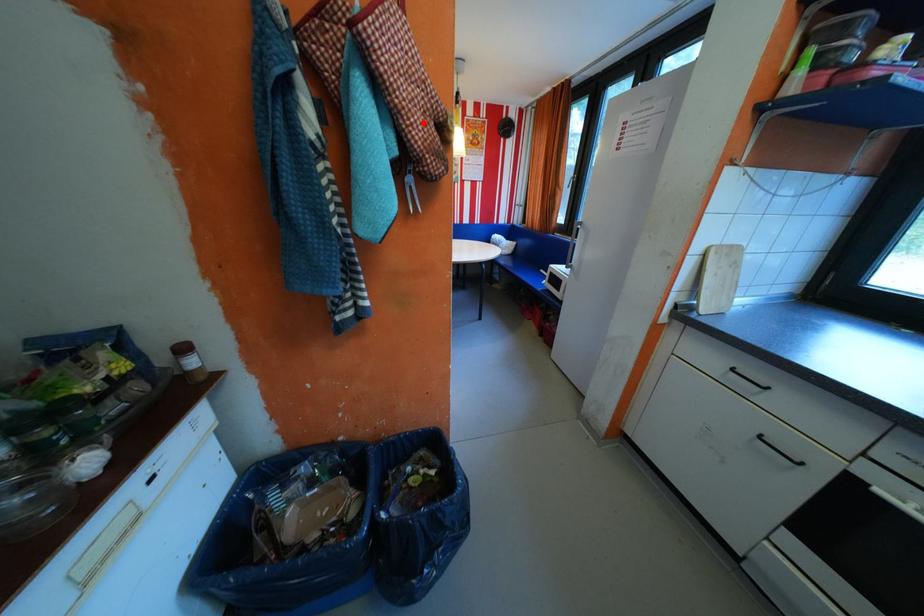
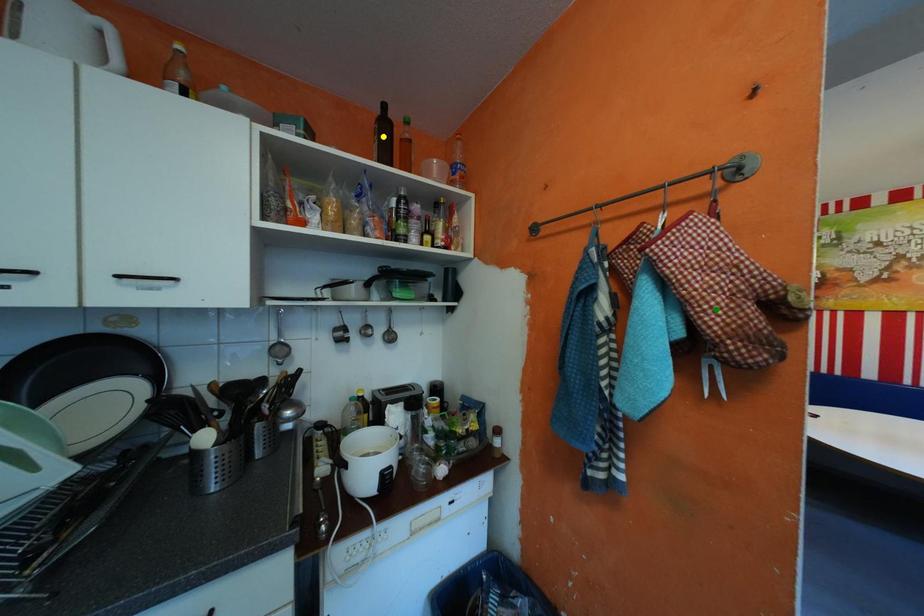
Question: I am providing you with two images of the same scene from different viewpoints. A red point is marked on the first image. You are given multiple points on the second image. Which spot in image 2 lines up with the point in image 1?

Choices:
 (A) green point
 (B) blue point
 (C) yellow point

Answer: (A)